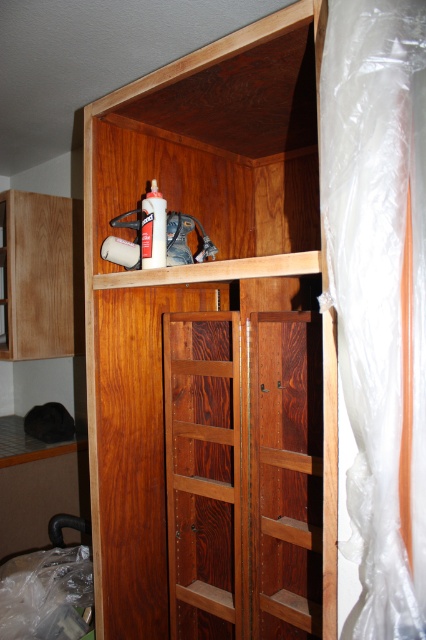
Where is `wooden cabinet at upper center`? The image size is (426, 640). wooden cabinet at upper center is located at coordinates (213, 340).

What do you see at coordinates (213, 340) in the screenshot?
I see `wooden cabinet at upper center` at bounding box center [213, 340].

Where is `wooden cabinet at upper center`? This screenshot has height=640, width=426. wooden cabinet at upper center is located at coordinates (213, 340).

Which is more to the right, wooden cabinet at upper center or matte wood shelf at left?

Positioned to the right is wooden cabinet at upper center.

Is wooden cabinet at upper center positioned behind matte wood shelf at left?

That is False.

Which is in front, point (100, 442) or point (57, 291)?

Point (100, 442)

Find the location of `wooden cabinet at upper center`. wooden cabinet at upper center is located at coordinates (213, 340).

The image size is (426, 640). What do you see at coordinates (42, 275) in the screenshot?
I see `matte wood shelf at left` at bounding box center [42, 275].

Who is taller, matte wood shelf at left or matte white spray can at upper center?

Standing taller between the two is matte wood shelf at left.

Does point (74, 333) come closer to viewer compared to point (147, 225)?

No, (74, 333) is behind (147, 225).

Where is `matte wood shelf at left`? This screenshot has height=640, width=426. matte wood shelf at left is located at coordinates (42, 275).